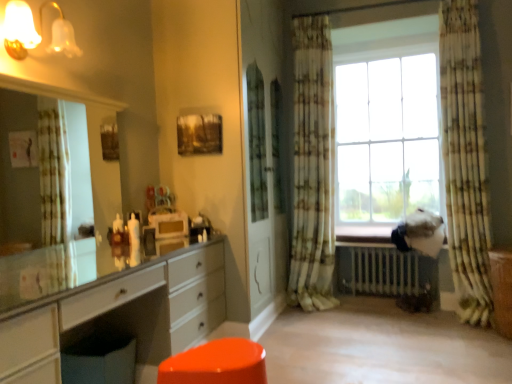
Question: Can you confirm if brown wood file cabinet at lower right is thinner than white glossy chest of drawers at left?

Choices:
 (A) yes
 (B) no

Answer: (B)

Question: From the image's perspective, is brown wood file cabinet at lower right located beneath white glossy chest of drawers at left?

Choices:
 (A) no
 (B) yes

Answer: (A)

Question: From a real-world perspective, is brown wood file cabinet at lower right under white glossy chest of drawers at left?

Choices:
 (A) no
 (B) yes

Answer: (B)

Question: Are brown wood file cabinet at lower right and white glossy chest of drawers at left beside each other?

Choices:
 (A) no
 (B) yes

Answer: (A)

Question: From the image's perspective, is brown wood file cabinet at lower right over white glossy chest of drawers at left?

Choices:
 (A) yes
 (B) no

Answer: (A)

Question: Is white glossy chest of drawers at left surrounded by brown wood file cabinet at lower right?

Choices:
 (A) no
 (B) yes

Answer: (A)

Question: Does metallic silver radiator at lower center have a lesser width compared to matte glass sconce at upper left?

Choices:
 (A) no
 (B) yes

Answer: (A)

Question: Is metallic silver radiator at lower center closer to the viewer compared to matte glass sconce at upper left?

Choices:
 (A) yes
 (B) no

Answer: (B)

Question: Does metallic silver radiator at lower center have a greater height compared to matte glass sconce at upper left?

Choices:
 (A) yes
 (B) no

Answer: (A)

Question: Is matte glass sconce at upper left at the back of metallic silver radiator at lower center?

Choices:
 (A) no
 (B) yes

Answer: (A)

Question: Is metallic silver radiator at lower center shorter than matte glass sconce at upper left?

Choices:
 (A) no
 (B) yes

Answer: (A)

Question: Is matte glass sconce at upper left surrounded by metallic silver radiator at lower center?

Choices:
 (A) yes
 (B) no

Answer: (B)

Question: Is patterned fabric curtain at center, which appears as the first curtain when viewed from the left, oriented away from brown wood file cabinet at lower right?

Choices:
 (A) no
 (B) yes

Answer: (A)